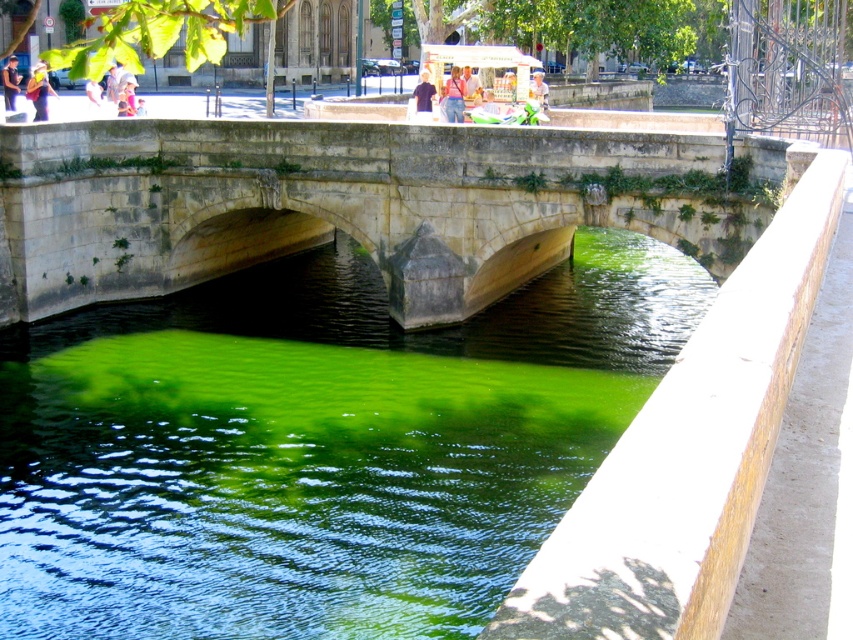
Does green algae at center have a larger size compared to stone bridge at center?

Yes, green algae at center is bigger than stone bridge at center.

Looking at this image, measure the distance between green algae at center and stone bridge at center.

They are 4.26 meters apart.

Between point (558, 508) and point (643, 132), which one is positioned behind?

The point (643, 132) is behind.

Where is `green algae at center`? green algae at center is located at coordinates (316, 445).